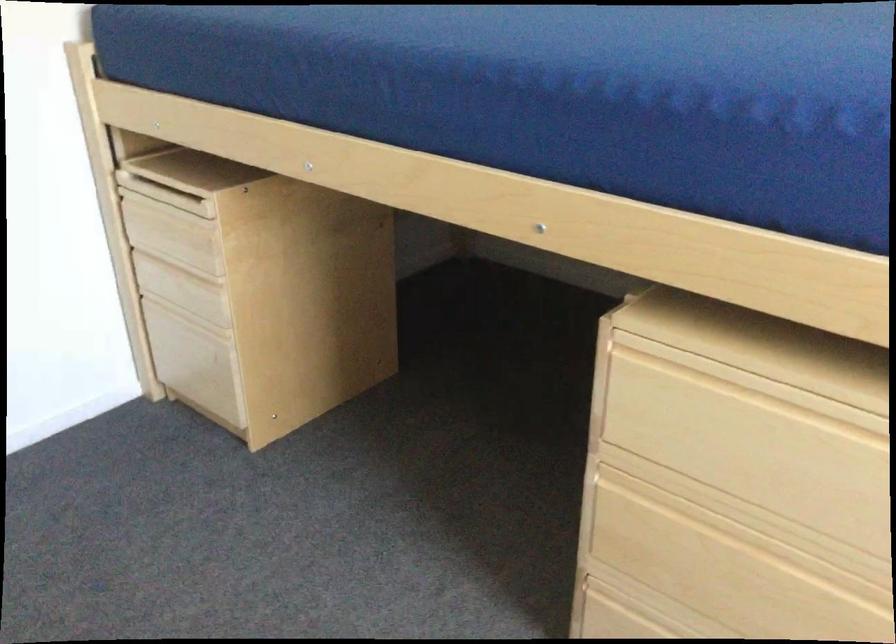
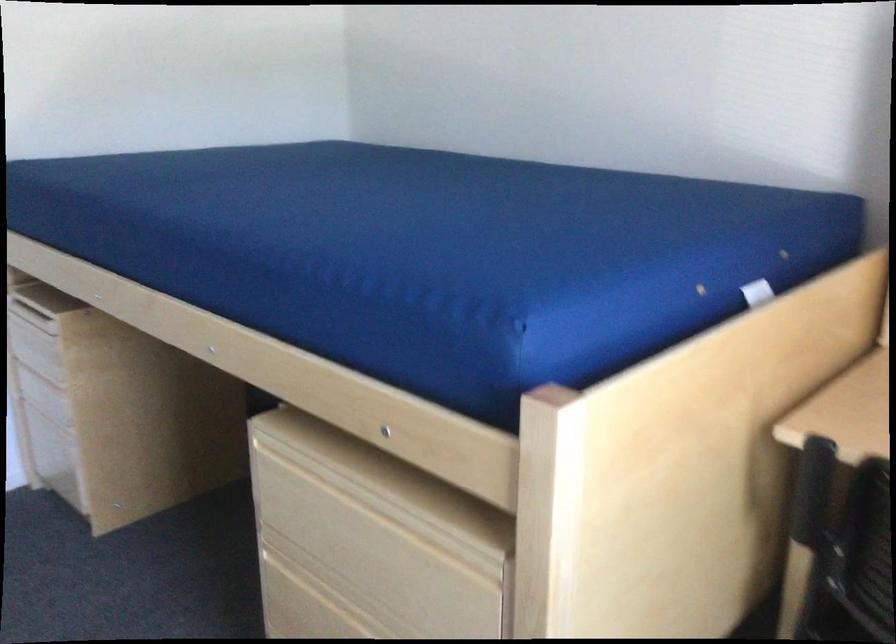
Find the pixel in the second image that matches pixel 130 292 in the first image.

(19, 395)